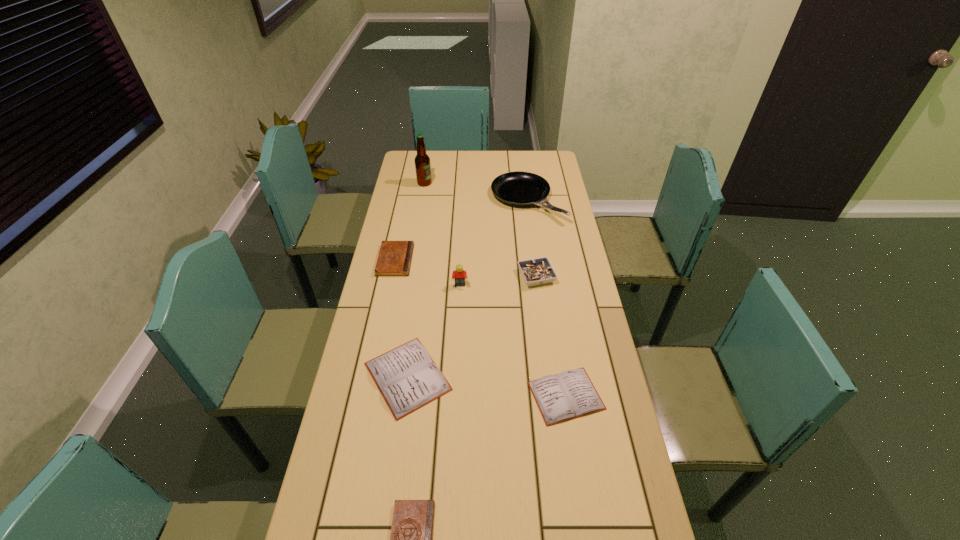
Find the location of `free point that satisfies the following two spatial constraints: 1. on the back side of the left white diary; 2. on the spine side of the farther brown diary`. free point that satisfies the following two spatial constraints: 1. on the back side of the left white diary; 2. on the spine side of the farther brown diary is located at coordinates tap(423, 260).

The width and height of the screenshot is (960, 540). What are the coordinates of `vacant position in the image that satisfies the following two spatial constraints: 1. on the label of the pan; 2. on the right side of the brown beer bottle` in the screenshot? It's located at (421, 200).